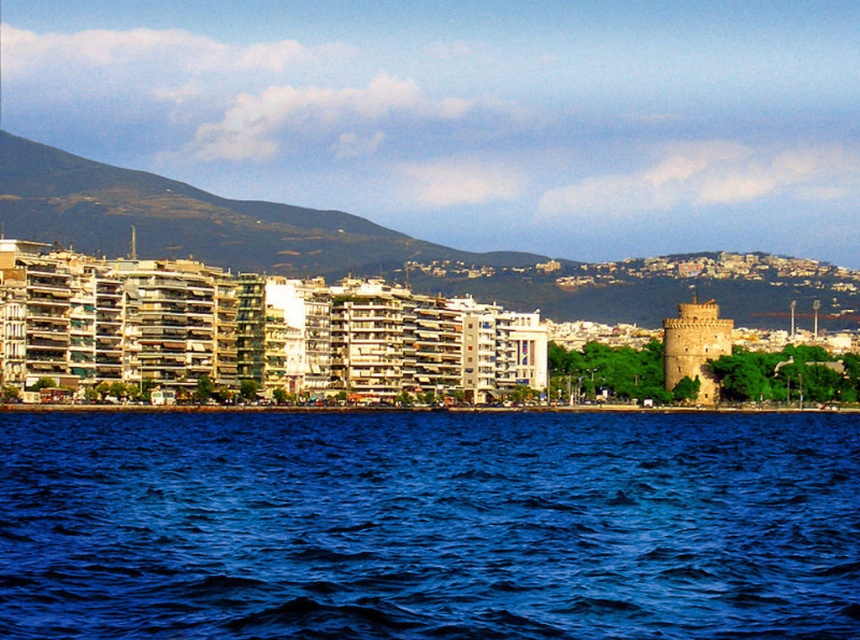
You are a photographer planning to capture a landscape photo that includes both the green textured mountain at upper left and the light brown stone tower at right. Based on their positions, which object should you place on the left side of your photo to ensure both are framed properly?

The green textured mountain at upper left should be placed on the left side of the photo because it is already positioned to the left of the light brown stone tower at right in the scene.

You are a landscape photographer planning to capture the coastal scene. You want to ensure both the blue liquid water at lower center and the green textured mountain at upper left are visible in your shot. Given their spatial relationship, which object will occupy a smaller portion of the final photograph?

The blue liquid water at lower center occupies less space than the green textured mountain at upper left, so it will take up a smaller portion in the photograph.

You are an architect analyzing the coastal view. You need to determine the spatial relationship between the green textured mountain at upper left and the light brown stone tower at right. Which of these two objects occupies a larger horizontal space in the image?

The green textured mountain at upper left occupies a larger horizontal space in the image because its width is larger than that of the light brown stone tower at right.